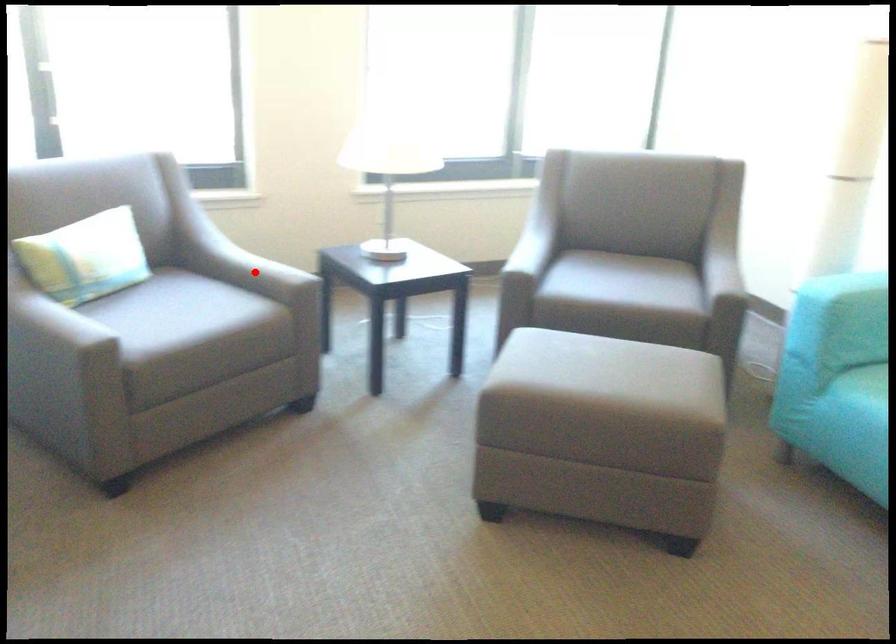
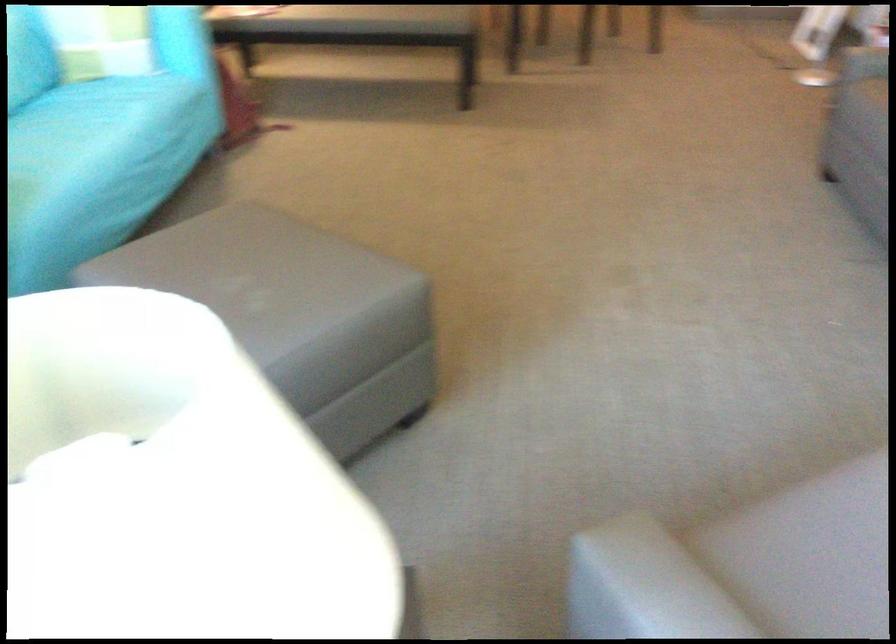
Question: A red point is marked in image1. In image2, is the corresponding 3D point closer to the camera or farther? Reply with the corresponding letter.

Choices:
 (A) The corresponding 3D point is closer.
 (B) The corresponding 3D point is farther.

Answer: (A)